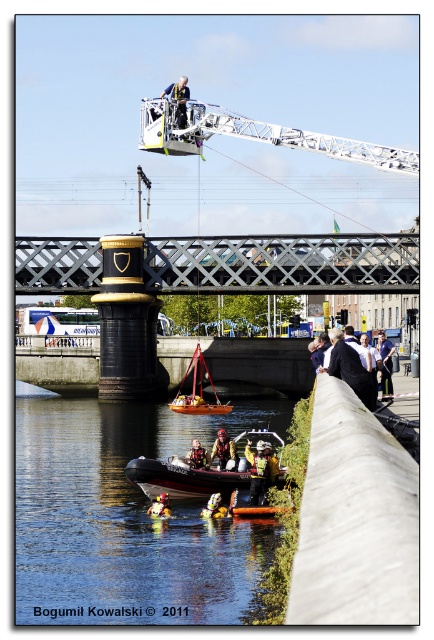
You are a safety inspector evaluating the rescue operation under the bridge. You notice the white metallic crane at upper center and the red helmet at lower center. Which object has a greater width according to the scene?

The white metallic crane at upper center has a greater width than the red helmet at lower center.

You are a safety inspector evaluating the rescue operation under the bridge. You notice the white metallic crane at upper center and the red helmet at lower center. Which object is bigger in size?

The white metallic crane at upper center is larger in size than the red helmet at lower center.

You are a photographer trying to capture both the rubber inflatable boat at lower center and the wooden sailboat at center in a single shot. Given their sizes, which boat should you focus on to ensure both are visible without zooming in or out?

Since the rubber inflatable boat at lower center is bigger than the wooden sailboat at center, you should focus on the rubber inflatable boat at lower center to ensure both are visible without adjusting the zoom. Position yourself so the larger boat fills the frame appropriately, allowing the smaller wooden sailboat to remain in view.